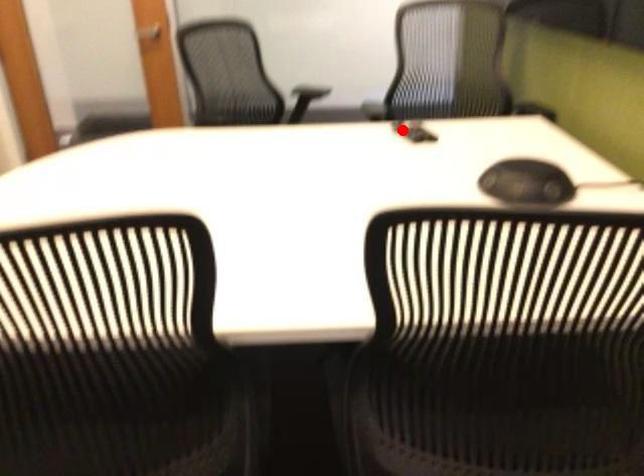
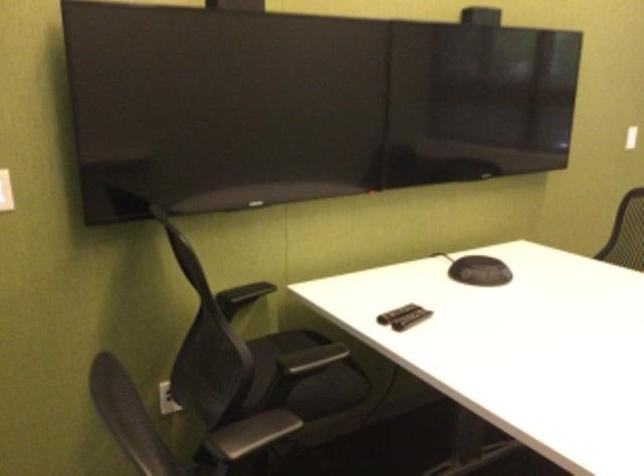
Question: I am providing you with two images of the same scene from different viewpoints. Given a red point in image1, look at the same physical point in image2. Is it:

Choices:
 (A) Closer to the viewpoint
 (B) Farther from the viewpoint

Answer: (A)